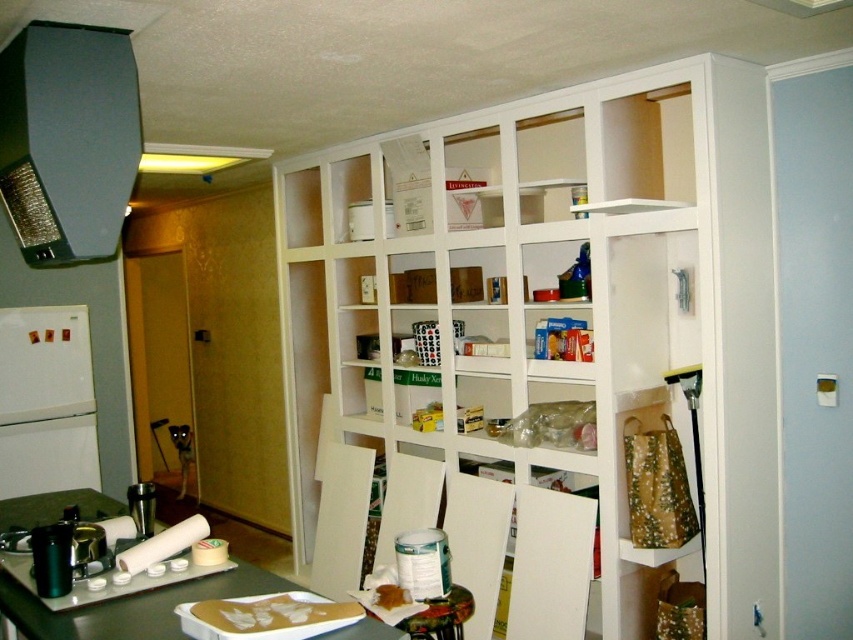
Is satin black exhaust hood at upper left shorter than white cardboard box at upper center?

In fact, satin black exhaust hood at upper left may be taller than white cardboard box at upper center.

Measure the distance between satin black exhaust hood at upper left and camera.

1.78 meters

The image size is (853, 640). What are the coordinates of `satin black exhaust hood at upper left` in the screenshot? It's located at (68, 140).

Who is positioned more to the left, satin black exhaust hood at upper left or white matte refrigerator at left?

white matte refrigerator at left is more to the left.

Can you confirm if satin black exhaust hood at upper left is shorter than white matte refrigerator at left?

Yes, satin black exhaust hood at upper left is shorter than white matte refrigerator at left.

Identify the location of satin black exhaust hood at upper left. Image resolution: width=853 pixels, height=640 pixels. (68, 140).

This screenshot has height=640, width=853. What do you see at coordinates (45, 401) in the screenshot? I see `white matte refrigerator at left` at bounding box center [45, 401].

Is point (9, 444) closer to camera compared to point (392, 221)?

No, it is behind (392, 221).

Where is `white matte refrigerator at left`? Image resolution: width=853 pixels, height=640 pixels. white matte refrigerator at left is located at coordinates (45, 401).